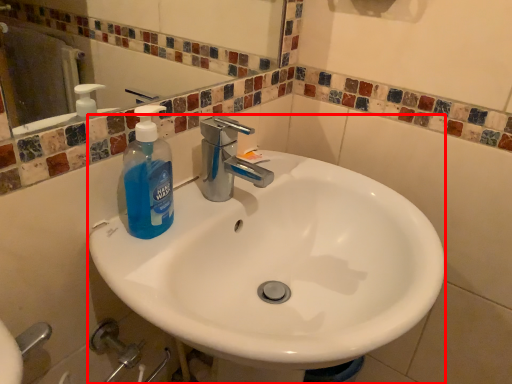
Question: Considering the relative positions of sink (annotated by the red box) and bottle in the image provided, where is sink (annotated by the red box) located with respect to the staircase?

Choices:
 (A) right
 (B) left

Answer: (A)